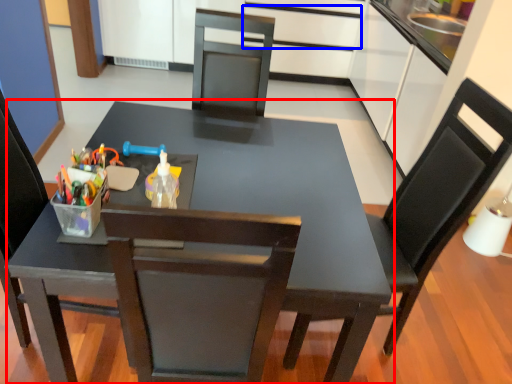
Question: Which point is closer to the camera, table (highlighted by a red box) or drawer (highlighted by a blue box)?

Choices:
 (A) table
 (B) drawer

Answer: (A)